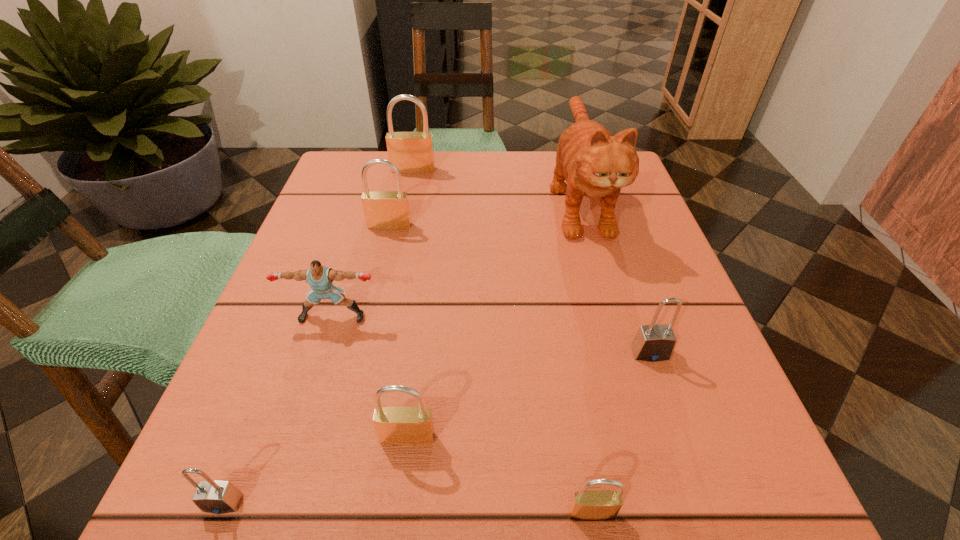
Locate an element on the screen. This screenshot has height=540, width=960. cat is located at coordinates (594, 163).

Locate an element on the screen. This screenshot has width=960, height=540. the tallest object is located at coordinates (594, 163).

Image resolution: width=960 pixels, height=540 pixels. Find the location of `the farthest padlock`. the farthest padlock is located at coordinates (411, 152).

The width and height of the screenshot is (960, 540). What are the coordinates of `the farthest brass padlock` in the screenshot? It's located at (411, 152).

Where is `the sixth shortest object`? This screenshot has height=540, width=960. the sixth shortest object is located at coordinates (388, 210).

Identify the location of the second farthest brass padlock. (388, 210).

This screenshot has width=960, height=540. In order to click on puncher in this screenshot , I will do `click(319, 277)`.

Identify the location of the fifth nearest object. The image size is (960, 540). (319, 277).

Locate an element on the screen. the right gray padlock is located at coordinates (654, 342).

Locate an element on the screen. The image size is (960, 540). the rightmost padlock is located at coordinates (654, 342).